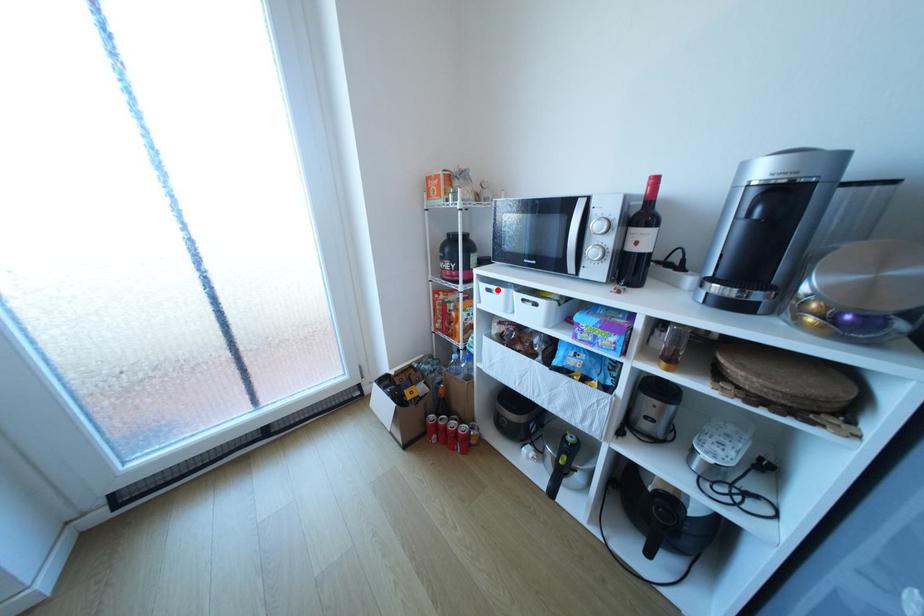
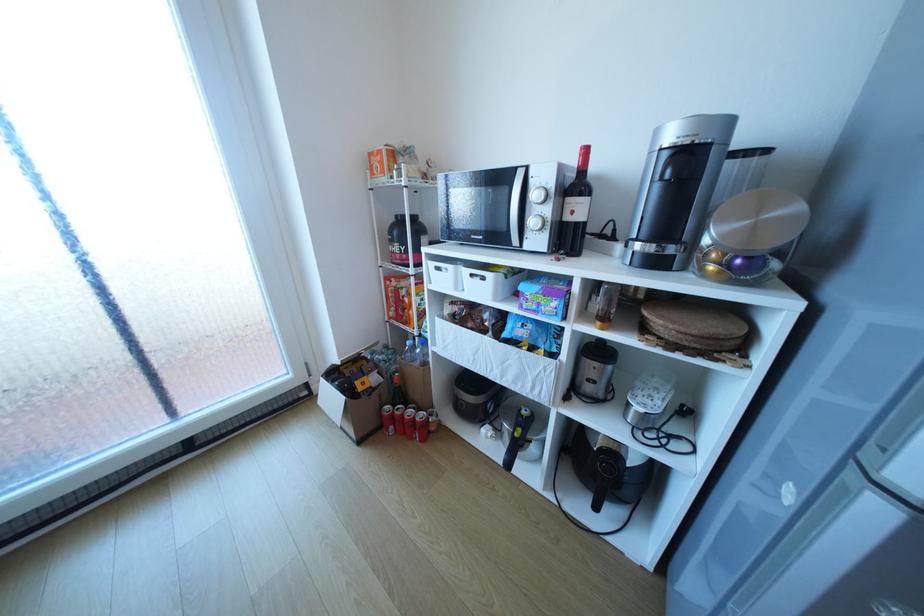
The point at the highlighted location is marked in the first image. Where is the corresponding point in the second image?

(446, 268)